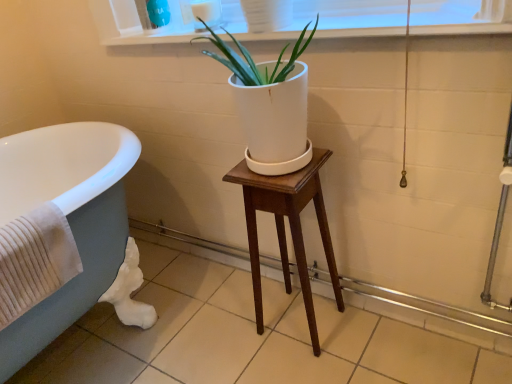
The height and width of the screenshot is (384, 512). I want to click on vacant point to the right of mahogany wood stool at center, so click(367, 344).